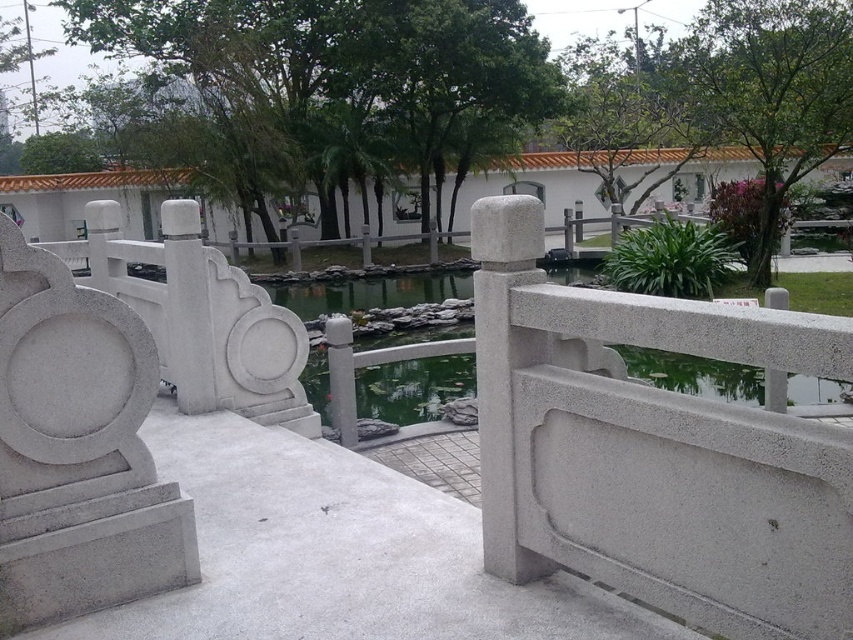
Question: Observing the image, what is the correct spatial positioning of gray stone railing at center in reference to white stone railing at left?

Choices:
 (A) above
 (B) below

Answer: (B)

Question: Considering the relative positions of gray stone railing at center and white stone railing at left in the image provided, where is gray stone railing at center located with respect to white stone railing at left?

Choices:
 (A) left
 (B) right

Answer: (B)

Question: Which point is closer to the camera?

Choices:
 (A) gray stone railing at center
 (B) white stone railing at left

Answer: (A)

Question: Is gray stone railing at center positioned before white stone railing at left?

Choices:
 (A) yes
 (B) no

Answer: (A)